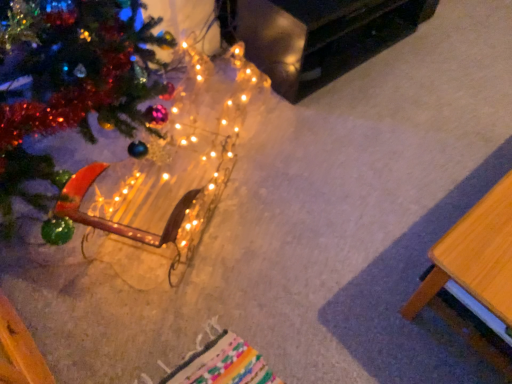
Question: Considering the positions of illuminated wireframe horse at lower left and wooden table at lower right, marked as the second table in a back-to-front arrangement, in the image, is illuminated wireframe horse at lower left wider or thinner than wooden table at lower right, marked as the second table in a back-to-front arrangement,?

Choices:
 (A) wide
 (B) thin

Answer: (A)

Question: Is point (174, 117) positioned closer to the camera than point (410, 297)?

Choices:
 (A) closer
 (B) farther

Answer: (B)

Question: Which is nearer to the black glossy table at upper right, which is the first table in top-to-bottom order?

Choices:
 (A) wooden table at lower right, arranged as the 2th table when viewed from the top
 (B) illuminated wireframe horse at lower left

Answer: (B)

Question: Estimate the real-world distances between objects in this image. Which object is farther from the illuminated wireframe horse at lower left?

Choices:
 (A) wooden table at lower right, arranged as the 2th table when viewed from the top
 (B) black glossy table at upper right, which is counted as the 2th table, starting from the bottom

Answer: (A)